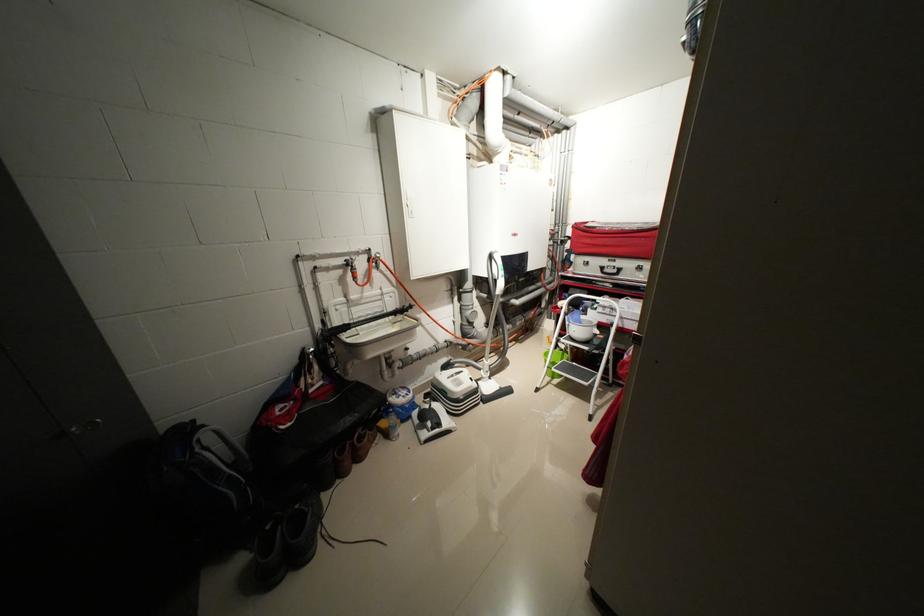
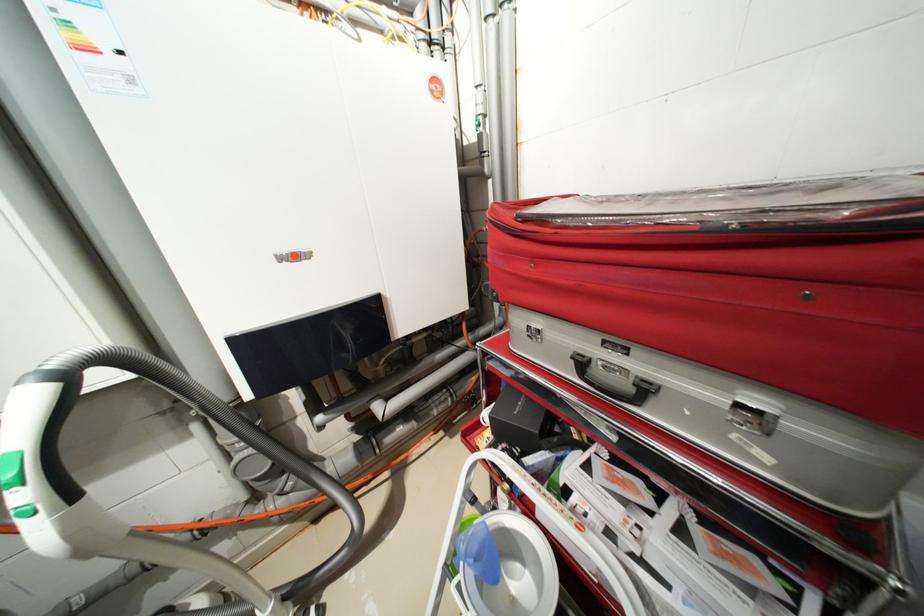
Find the pixel in the second image that matches point (610, 269) in the first image.

(589, 363)